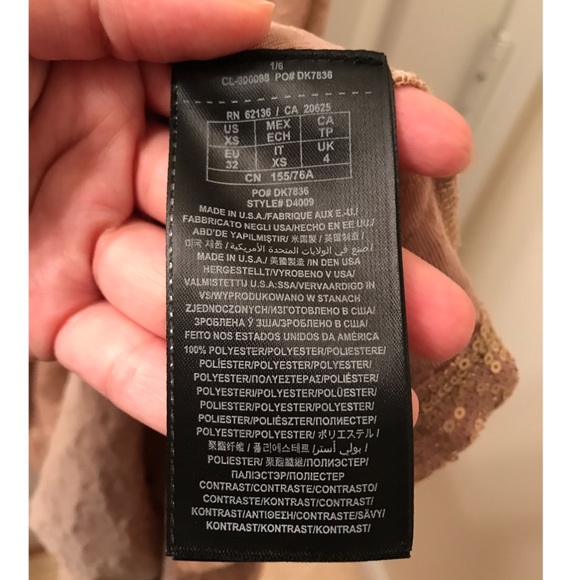
At what (x,y) coordinates should I click in order to perform the action: click on beige floor. Please return your answer as a coordinate pair (x, y). Image resolution: width=580 pixels, height=580 pixels. Looking at the image, I should click on (334, 571).